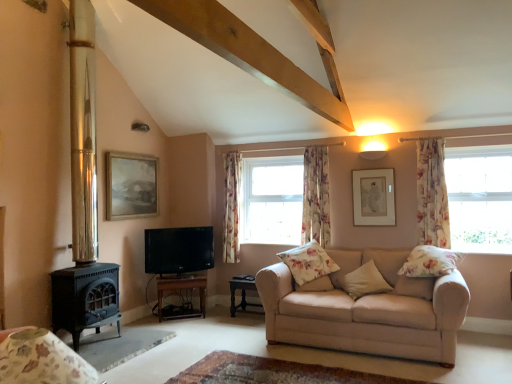
Question: Is black glossy tv at left not inside wooden tv stand at lower center, the 2th table in the right-to-left sequence?

Choices:
 (A) yes
 (B) no

Answer: (A)

Question: From the image's perspective, is black glossy tv at left on top of wooden tv stand at lower center, the 2th table in the right-to-left sequence?

Choices:
 (A) no
 (B) yes

Answer: (B)

Question: Is black glossy tv at left taller than wooden tv stand at lower center, arranged as the first table when viewed from the left?

Choices:
 (A) yes
 (B) no

Answer: (A)

Question: Can you confirm if black glossy tv at left is thinner than wooden tv stand at lower center, arranged as the first table when viewed from the left?

Choices:
 (A) no
 (B) yes

Answer: (B)

Question: Is black glossy tv at left far from wooden tv stand at lower center, arranged as the first table when viewed from the left?

Choices:
 (A) yes
 (B) no

Answer: (B)

Question: Is black glossy tv at left to the left of wooden tv stand at lower center, arranged as the first table when viewed from the left, from the viewer's perspective?

Choices:
 (A) yes
 (B) no

Answer: (A)

Question: Is floral fabric pillow at right, the first pillow viewed from the right, surrounding beige fabric couch at lower right?

Choices:
 (A) no
 (B) yes

Answer: (A)

Question: Considering the relative positions of floral fabric pillow at right, the fourth pillow when ordered from left to right, and beige fabric couch at lower right in the image provided, is floral fabric pillow at right, the fourth pillow when ordered from left to right, to the right of beige fabric couch at lower right from the viewer's perspective?

Choices:
 (A) no
 (B) yes

Answer: (B)

Question: Does floral fabric pillow at right, the first pillow viewed from the right, lie in front of beige fabric couch at lower right?

Choices:
 (A) no
 (B) yes

Answer: (A)

Question: Can you confirm if floral fabric pillow at right, the first pillow viewed from the right, is bigger than beige fabric couch at lower right?

Choices:
 (A) no
 (B) yes

Answer: (A)

Question: Is floral fabric pillow at right, the fourth pillow when ordered from left to right, positioned beyond the bounds of beige fabric couch at lower right?

Choices:
 (A) no
 (B) yes

Answer: (A)

Question: Is floral fabric pillow at right, the first pillow viewed from the right, positioned behind beige fabric couch at lower right?

Choices:
 (A) no
 (B) yes

Answer: (B)

Question: Can you confirm if floral fabric pillow at right, the first pillow viewed from the right, is positioned to the right of floral fabric curtain at right, the 1th curtain when ordered from front to back?

Choices:
 (A) yes
 (B) no

Answer: (B)